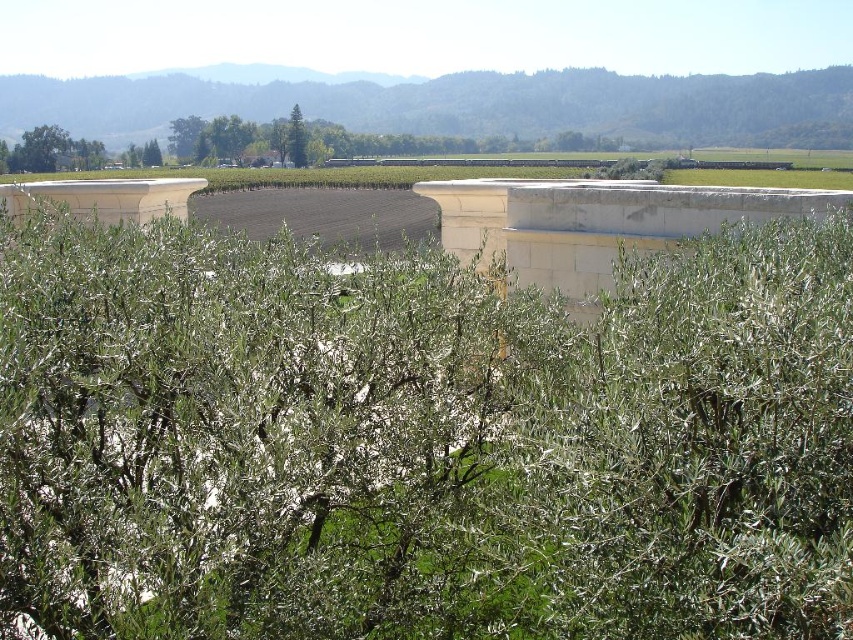
The height and width of the screenshot is (640, 853). Identify the location of green leafy tree at center. pyautogui.click(x=296, y=138).

Is green leafy tree at center bigger than green leafy tree at upper center?

Yes.

Where is `green leafy tree at center`? green leafy tree at center is located at coordinates (296, 138).